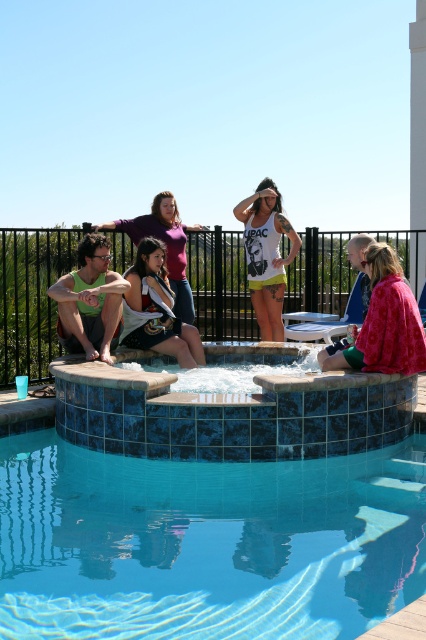
You are a photographer standing at the edge of the pool. You want to take a photo that includes both the floral fabric jacket at lower right and the white matte tank top at center. What is the minimum distance you need to move backward to ensure both objects are fully in frame?

The floral fabric jacket at lower right and white matte tank top at center are 2.05 meters apart. To capture both in the frame, you need to move back at least 2.05 meters to ensure the entire distance between them fits within the camera view.

You are planning to host a pool party and need to place a large inflatable raft in the blue tile swimming pool at lower center. Considering the size of the floral fabric jacket at lower right, will the pool be wide enough to accommodate the raft?

The blue tile swimming pool at lower center is wider than the floral fabric jacket at lower right, so it should be wide enough to accommodate the large inflatable raft.